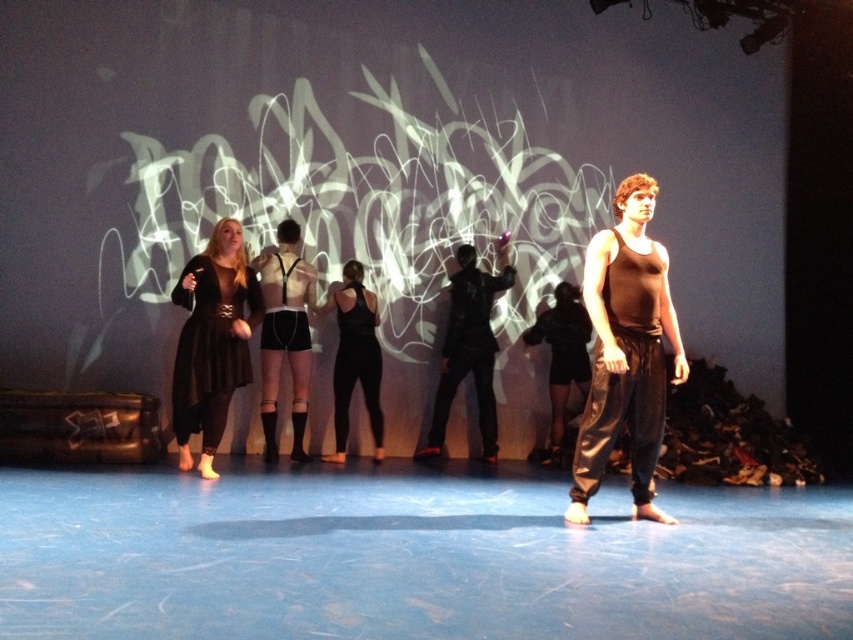
You are a stage director observing the performance. You notice a point at coordinates (285, 336) on your stage map. What object or costume element is located at that specific coordinate?

The point at coordinates (285, 336) corresponds to matte black shorts at center.

You are a stagehand standing at the point marked at coordinates point (x=263, y=336). You need to move a prop from the point to the nearest performer. How far will you have to walk to reach the nearest performer?

The distance between the point (x=263, y=336) and the nearest performer is 6.57 meters, so you will have to walk 6.57 meters to reach them.

You are a photographer in the audience taking pictures of the stage. You want to capture both the matte black dress at left and the black matte pants at center in a single shot. Which object should you focus on first to ensure both are in sharp focus?

The matte black dress at left is closer to the viewer than the black matte pants at center. To ensure both are in sharp focus, focus on the matte black dress at left since it is closer, and the depth of field will extend to the farther object.